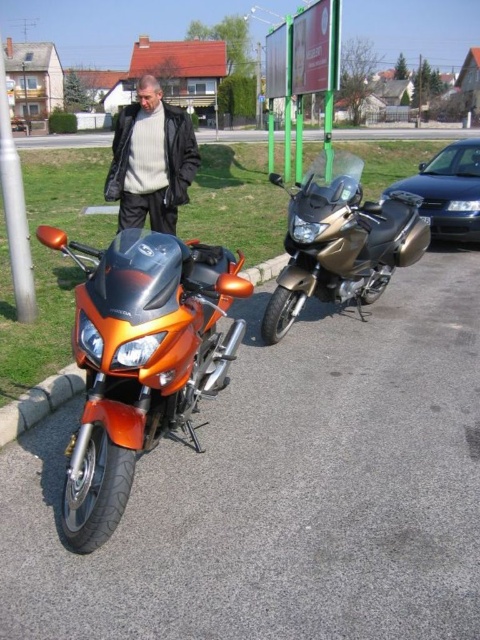
Does matte black jacket at center have a greater height compared to silver metallic pole at left?

Yes.

Looking at this image, between matte black jacket at center and silver metallic pole at left, which one is positioned higher?

Positioned higher is matte black jacket at center.

Locate an element on the screen. This screenshot has width=480, height=640. matte black jacket at center is located at coordinates (151, 161).

Does point (301, 237) come in front of point (128, 156)?

Yes.

Describe the element at coordinates (340, 241) in the screenshot. The width and height of the screenshot is (480, 640). I see `gold metallic motorcycle at center` at that location.

Locate an element on the screen. The width and height of the screenshot is (480, 640). gold metallic motorcycle at center is located at coordinates (340, 241).

Find the location of a particular element. This screenshot has width=480, height=640. gold metallic motorcycle at center is located at coordinates (x=340, y=241).

Is point (278, 182) positioned after point (6, 138)?

Yes.

Between gold metallic motorcycle at center and silver metallic pole at left, which one appears on the left side from the viewer's perspective?

silver metallic pole at left is more to the left.

Which is in front, point (336, 180) or point (19, 259)?

Positioned in front is point (336, 180).

Identify the location of gold metallic motorcycle at center. The image size is (480, 640). (340, 241).